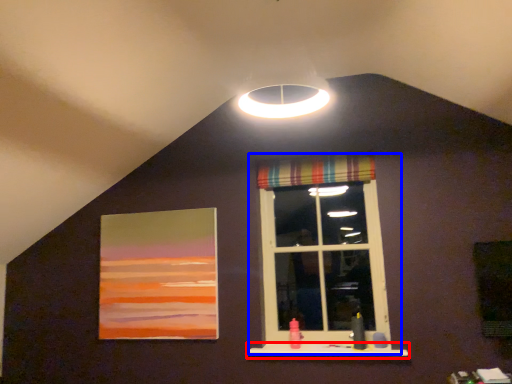
Question: Which of the following is the closest to the observer, window sill (highlighted by a red box) or window (highlighted by a blue box)?

Choices:
 (A) window sill
 (B) window

Answer: (A)